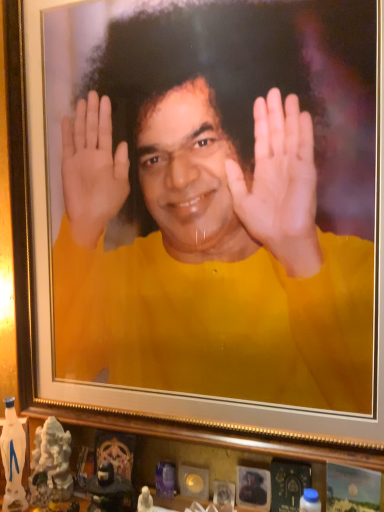
Question: Is white glossy statue at lower left, acting as the 2th toy starting from the right, with matte black statue at lower center, marked as the 1th toy in a right-to-left arrangement?

Choices:
 (A) yes
 (B) no

Answer: (B)

Question: Does white glossy statue at lower left, acting as the 2th toy starting from the right, have a lesser width compared to matte black statue at lower center, marked as the 1th toy in a right-to-left arrangement?

Choices:
 (A) yes
 (B) no

Answer: (B)

Question: Is white glossy statue at lower left, which ranks as the 1th toy in left-to-right order, positioned with its back to matte black statue at lower center, marked as the 2th toy in a left-to-right arrangement?

Choices:
 (A) yes
 (B) no

Answer: (B)

Question: Can you confirm if white glossy statue at lower left, acting as the 2th toy starting from the right, is bigger than matte black statue at lower center, marked as the 2th toy in a left-to-right arrangement?

Choices:
 (A) yes
 (B) no

Answer: (A)

Question: Does white glossy statue at lower left, which ranks as the 1th toy in left-to-right order, lie behind matte black statue at lower center, marked as the 2th toy in a left-to-right arrangement?

Choices:
 (A) no
 (B) yes

Answer: (B)

Question: Would you say yellow matte shirt at center is inside or outside matte black statue at lower center, marked as the 1th toy in a right-to-left arrangement?

Choices:
 (A) inside
 (B) outside

Answer: (B)

Question: In the image, is yellow matte shirt at center on the left side or the right side of matte black statue at lower center, marked as the 1th toy in a right-to-left arrangement?

Choices:
 (A) left
 (B) right

Answer: (B)

Question: In terms of width, does yellow matte shirt at center look wider or thinner when compared to matte black statue at lower center, marked as the 2th toy in a left-to-right arrangement?

Choices:
 (A) thin
 (B) wide

Answer: (A)

Question: Looking at the image, does yellow matte shirt at center seem bigger or smaller compared to matte black statue at lower center, marked as the 2th toy in a left-to-right arrangement?

Choices:
 (A) small
 (B) big

Answer: (B)

Question: Looking at the image, does matte black statue at lower center, marked as the 1th toy in a right-to-left arrangement, seem bigger or smaller compared to white glossy statue at lower left, acting as the 2th toy starting from the right?

Choices:
 (A) big
 (B) small

Answer: (B)

Question: Which is correct: matte black statue at lower center, marked as the 2th toy in a left-to-right arrangement, is inside white glossy statue at lower left, acting as the 2th toy starting from the right, or outside of it?

Choices:
 (A) inside
 (B) outside

Answer: (B)

Question: From a real-world perspective, is matte black statue at lower center, marked as the 1th toy in a right-to-left arrangement, positioned above or below white glossy statue at lower left, acting as the 2th toy starting from the right?

Choices:
 (A) above
 (B) below

Answer: (B)

Question: Considering their positions, is matte black statue at lower center, marked as the 2th toy in a left-to-right arrangement, located in front of or behind white glossy statue at lower left, which ranks as the 1th toy in left-to-right order?

Choices:
 (A) front
 (B) behind

Answer: (A)

Question: From their relative heights in the image, would you say white glossy statue at lower left, acting as the 2th toy starting from the right, is taller or shorter than matte black statue at lower center, marked as the 2th toy in a left-to-right arrangement?

Choices:
 (A) tall
 (B) short

Answer: (A)

Question: From a real-world perspective, is white glossy statue at lower left, which ranks as the 1th toy in left-to-right order, positioned above or below matte black statue at lower center, marked as the 1th toy in a right-to-left arrangement?

Choices:
 (A) below
 (B) above

Answer: (B)